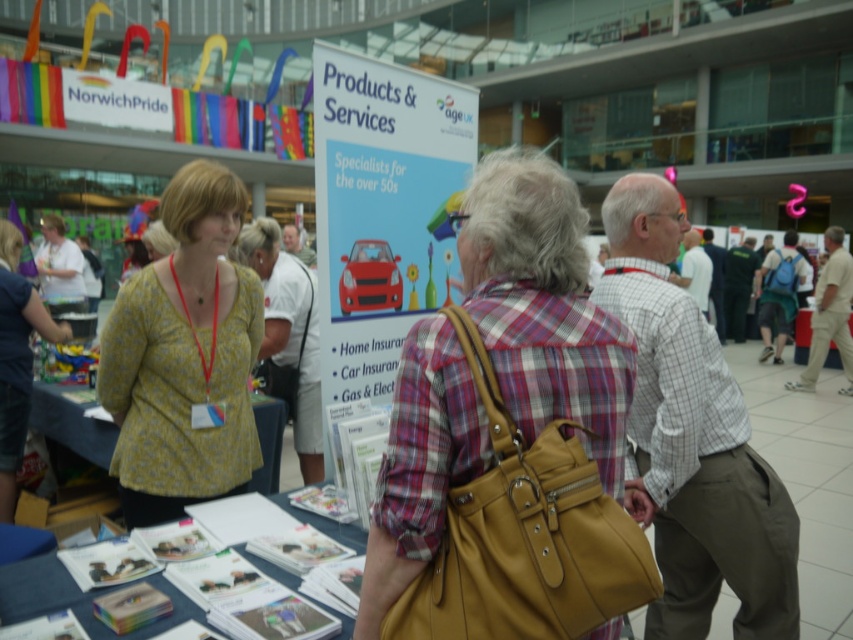
Is yellow floral blouse at left thinner than yellow floral shirt at center?

In fact, yellow floral blouse at left might be wider than yellow floral shirt at center.

Is yellow floral blouse at left above yellow floral shirt at center?

Yes, yellow floral blouse at left is above yellow floral shirt at center.

Is point (215, 352) positioned in front of point (274, 301)?

Yes, point (215, 352) is in front of point (274, 301).

Find the location of `yellow floral blouse at left`. yellow floral blouse at left is located at coordinates (184, 356).

Can you confirm if yellow floral blouse at left is taller than khaki cotton pants at center?

In fact, yellow floral blouse at left may be shorter than khaki cotton pants at center.

Is point (242, 195) positioned before point (845, 305)?

Yes, point (242, 195) is in front of point (845, 305).

Does point (163, 484) come behind point (827, 244)?

No, (163, 484) is closer to viewer.

The width and height of the screenshot is (853, 640). Find the location of `yellow floral blouse at left`. yellow floral blouse at left is located at coordinates (184, 356).

Is point (608, 195) positioned in front of point (294, 234)?

Yes, point (608, 195) is closer to viewer.

At what (x,y) coordinates should I click in order to perform the action: click on light brown plaid shirt at right. Please return your answer as a coordinate pair (x, y). The image size is (853, 640). Looking at the image, I should click on (692, 438).

Find the location of a particular element. The image size is (853, 640). light brown plaid shirt at right is located at coordinates (692, 438).